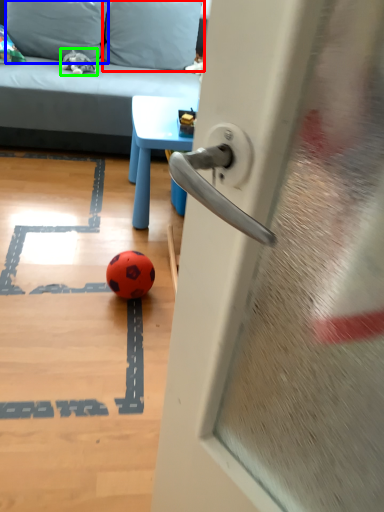
Question: Which is farther away from pillow (highlighted by a red box)? pillow (highlighted by a blue box) or miniature (highlighted by a green box)?

Choices:
 (A) pillow
 (B) miniature

Answer: (B)